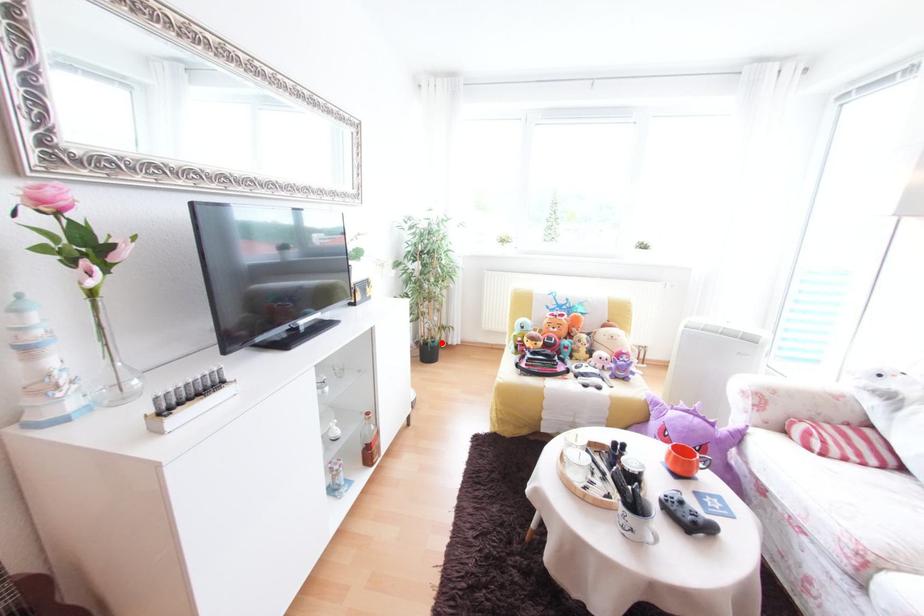
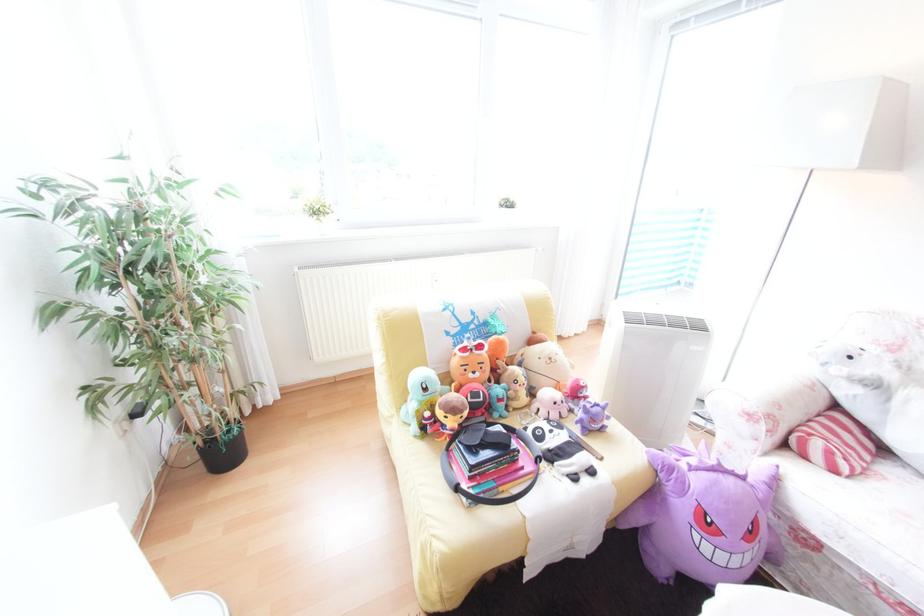
Question: I am providing you with two images of the same scene from different viewpoints. Given a red point in image1, look at the same physical point in image2. Is it:

Choices:
 (A) Closer to the viewpoint
 (B) Farther from the viewpoint

Answer: (B)